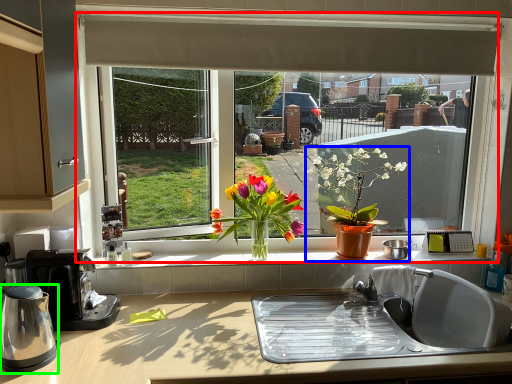
Question: Considering the real-world distances, which object is closest to window (highlighted by a red box)? houseplant (highlighted by a blue box) or kitchen appliance (highlighted by a green box).

Choices:
 (A) houseplant
 (B) kitchen appliance

Answer: (A)